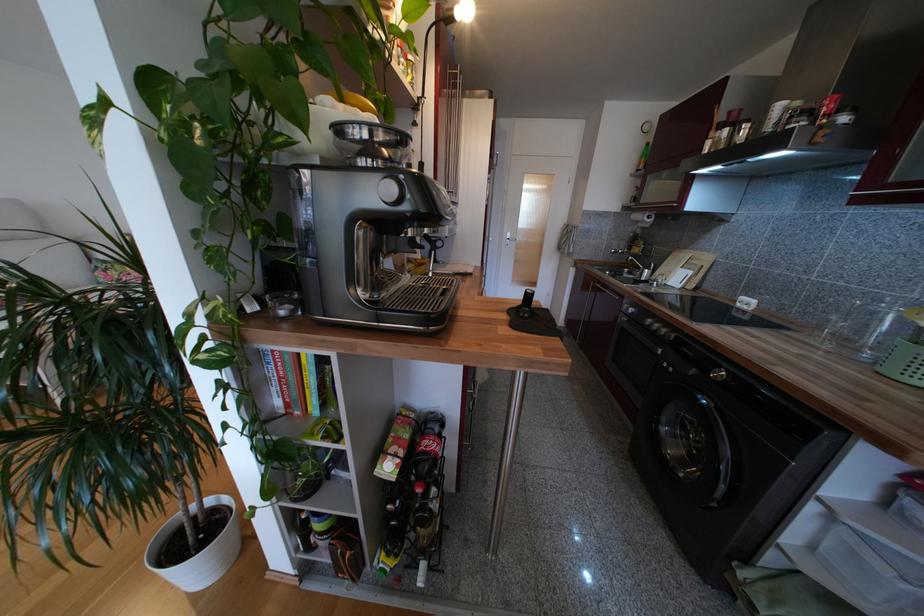
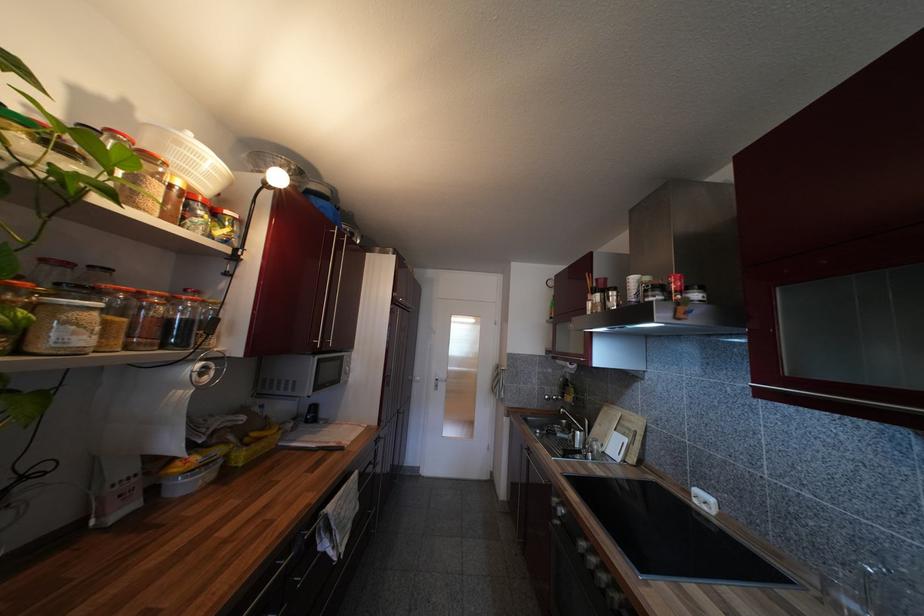
Find the pixel in the second image that matches [675,275] in the first image.

(610, 438)